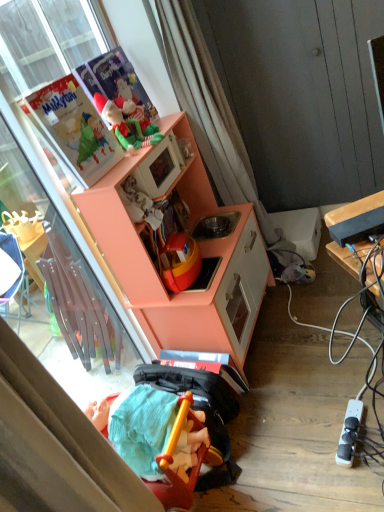
Locate an element on the screen. This screenshot has width=384, height=512. vacant space that is in between white sheer curtain at upper center and white plastic power outlet at lower right is located at coordinates (305, 351).